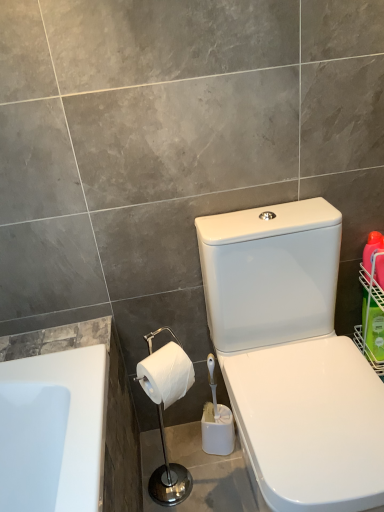
Question: Is the position of green plastic basket at right more distant than that of white glossy toilet at center-right?

Choices:
 (A) no
 (B) yes

Answer: (B)

Question: Could white glossy toilet at center-right be considered to be inside green plastic basket at right?

Choices:
 (A) yes
 (B) no

Answer: (B)

Question: Is green plastic basket at right directly adjacent to white glossy toilet at center-right?

Choices:
 (A) yes
 (B) no

Answer: (B)

Question: Are green plastic basket at right and white glossy toilet at center-right located far from each other?

Choices:
 (A) yes
 (B) no

Answer: (B)

Question: Can you confirm if green plastic basket at right is positioned to the left of white glossy toilet at center-right?

Choices:
 (A) yes
 (B) no

Answer: (B)

Question: Does point (268, 463) appear closer or farther from the camera than point (150, 356)?

Choices:
 (A) farther
 (B) closer

Answer: (B)

Question: From a real-world perspective, is white glossy toilet at center-right positioned above or below white matte toilet paper at lower center?

Choices:
 (A) below
 (B) above

Answer: (A)

Question: Is white glossy toilet at center-right taller or shorter than white matte toilet paper at lower center?

Choices:
 (A) short
 (B) tall

Answer: (B)

Question: Considering their positions, is white glossy toilet at center-right located in front of or behind white matte toilet paper at lower center?

Choices:
 (A) behind
 (B) front

Answer: (B)

Question: Is point (359, 330) closer or farther from the camera than point (203, 256)?

Choices:
 (A) closer
 (B) farther

Answer: (B)

Question: In the image, is green plastic basket at right positioned in front of or behind white glossy toilet at center-right?

Choices:
 (A) front
 (B) behind

Answer: (B)

Question: Visually, is green plastic basket at right positioned to the left or to the right of white glossy toilet at center-right?

Choices:
 (A) right
 (B) left

Answer: (A)

Question: Considering the positions of green plastic basket at right and white glossy toilet at center-right in the image, is green plastic basket at right wider or thinner than white glossy toilet at center-right?

Choices:
 (A) thin
 (B) wide

Answer: (A)

Question: Considering the positions of point [364, 346] and point [145, 358], is point [364, 346] closer or farther from the camera than point [145, 358]?

Choices:
 (A) farther
 (B) closer

Answer: (A)

Question: Is green plastic basket at right in front of or behind white glossy toilet paper holder at lower left in the image?

Choices:
 (A) behind
 (B) front

Answer: (A)